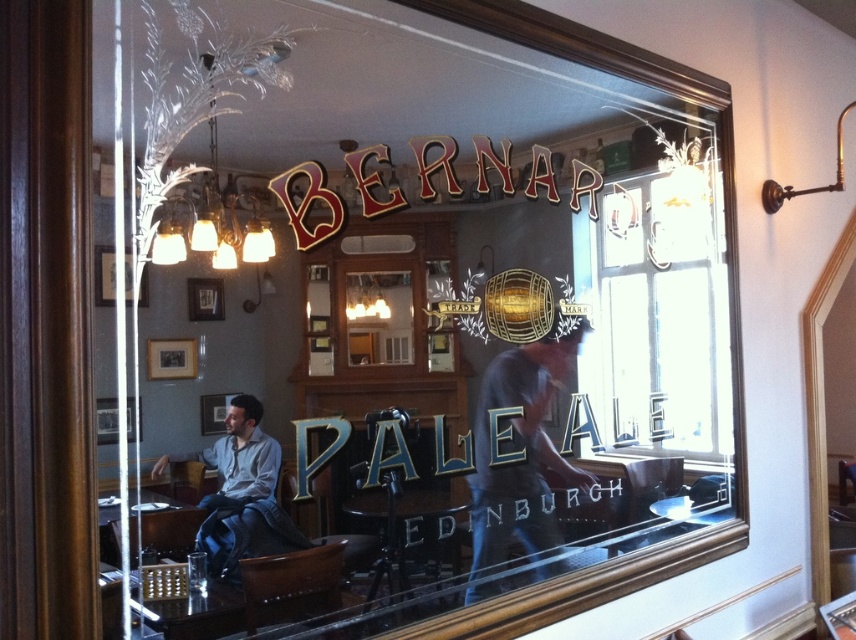
Question: Which point appears closest to the camera in this image?

Choices:
 (A) (556, 552)
 (B) (715, 381)

Answer: (A)

Question: Is transparent glass window at center to the right of dark blue jeans at center from the viewer's perspective?

Choices:
 (A) yes
 (B) no

Answer: (A)

Question: Which object appears farthest from the camera in this image?

Choices:
 (A) dark blue jeans at center
 (B) transparent glass window at center

Answer: (B)

Question: Does transparent glass window at center lie in front of dark blue jeans at center?

Choices:
 (A) yes
 (B) no

Answer: (B)

Question: Is transparent glass window at center bigger than dark blue jeans at center?

Choices:
 (A) no
 (B) yes

Answer: (B)